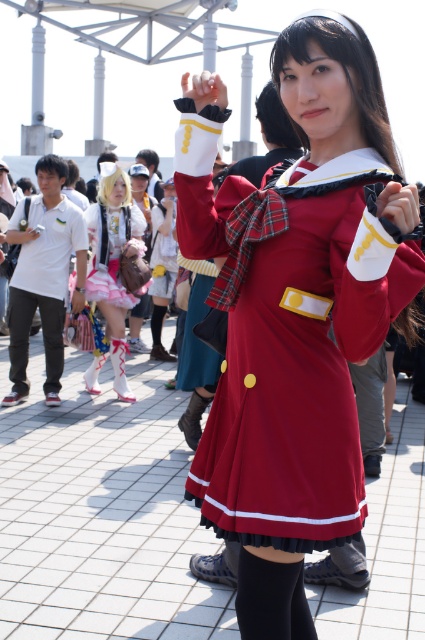
Can you confirm if pastel pink fabric dress at center is positioned above pastel pink tulle dress at center?

No.

Measure the distance between pastel pink fabric dress at center and pastel pink tulle dress at center.

pastel pink fabric dress at center and pastel pink tulle dress at center are 5.30 inches apart from each other.

Which is in front, point (90, 392) or point (118, 269)?

Point (118, 269) is more forward.

At what (x,y) coordinates should I click in order to perform the action: click on pastel pink fabric dress at center. Please return your answer as a coordinate pair (x, y). Image resolution: width=425 pixels, height=640 pixels. Looking at the image, I should click on (112, 269).

Does matte red dress at center appear over pastel pink fabric dress at center?

No, matte red dress at center is not above pastel pink fabric dress at center.

What do you see at coordinates (294, 310) in the screenshot? I see `matte red dress at center` at bounding box center [294, 310].

Identify the location of matte red dress at center. (294, 310).

Where is `matte red dress at center`? This screenshot has width=425, height=640. matte red dress at center is located at coordinates (294, 310).

Can you confirm if pastel pink tulle dress at center is smaller than black cotton pants at left?

Incorrect, pastel pink tulle dress at center is not smaller in size than black cotton pants at left.

I want to click on pastel pink tulle dress at center, so click(113, 252).

At what (x,y) coordinates should I click in order to perform the action: click on pastel pink tulle dress at center. Please return your answer as a coordinate pair (x, y). Looking at the image, I should click on (113, 252).